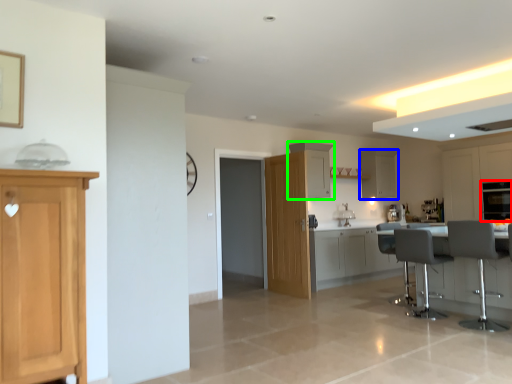
Question: Considering the real-world distances, which object is closest to oven (highlighted by a red box)? cabinetry (highlighted by a blue box) or cabinetry (highlighted by a green box).

Choices:
 (A) cabinetry
 (B) cabinetry

Answer: (A)